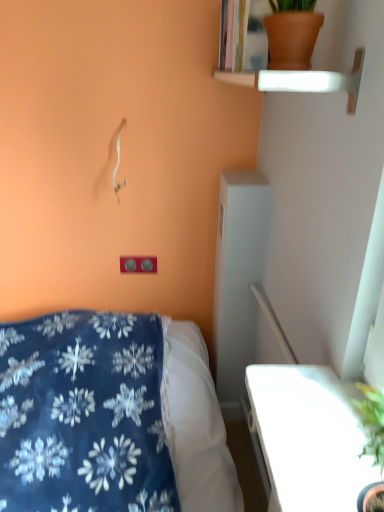
Question: From the image's perspective, is terracotta clay pot at upper right located above or below matte plastic outlet at lower center?

Choices:
 (A) below
 (B) above

Answer: (B)

Question: Is point (306, 16) closer or farther from the camera than point (145, 261)?

Choices:
 (A) closer
 (B) farther

Answer: (A)

Question: Is terracotta clay pot at upper right situated inside matte plastic outlet at lower center or outside?

Choices:
 (A) inside
 (B) outside

Answer: (B)

Question: From a real-world perspective, relative to terracotta clay pot at upper right, is matte plastic outlet at lower center vertically above or below?

Choices:
 (A) above
 (B) below

Answer: (B)

Question: From the image's perspective, relative to terracotta clay pot at upper right, is matte plastic outlet at lower center above or below?

Choices:
 (A) below
 (B) above

Answer: (A)

Question: Based on their sizes in the image, would you say matte plastic outlet at lower center is bigger or smaller than terracotta clay pot at upper right?

Choices:
 (A) small
 (B) big

Answer: (A)

Question: Is matte plastic outlet at lower center wider or thinner than terracotta clay pot at upper right?

Choices:
 (A) thin
 (B) wide

Answer: (A)